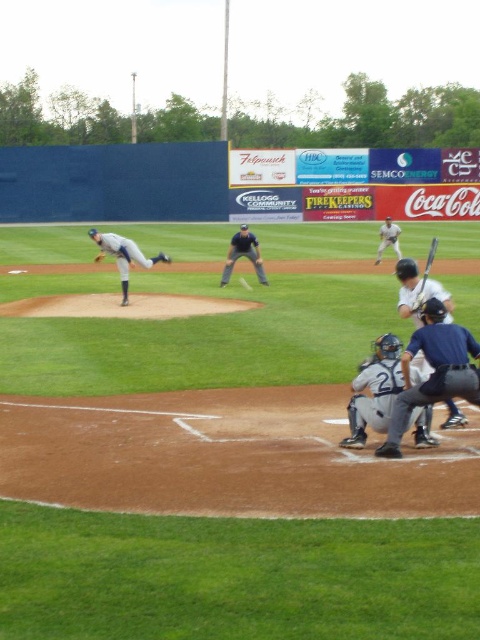
Question: Does white matte catcher at center have a lesser width compared to brown leather glove at center?

Choices:
 (A) no
 (B) yes

Answer: (B)

Question: Which point is farther from the camera taking this photo?

Choices:
 (A) (393, 413)
 (B) (394, 230)
 (C) (431, 253)
 (D) (424, 435)

Answer: (C)

Question: Which point appears closest to the camera in this image?

Choices:
 (A) (249, 248)
 (B) (357, 404)
 (C) (443, 356)

Answer: (C)

Question: Is white matte baseball bat at upper right behind wooden baseball bat at lower right?

Choices:
 (A) no
 (B) yes

Answer: (B)

Question: Is white matte catcher at center below wooden baseball bat at lower right?

Choices:
 (A) yes
 (B) no

Answer: (A)

Question: Which of these objects is positioned closest to the white matte catcher at center?

Choices:
 (A) gray matte uniform at center
 (B) white matte baseball bat at upper right
 (C) dark blue uniform at center
 (D) brown leather glove at center

Answer: (A)